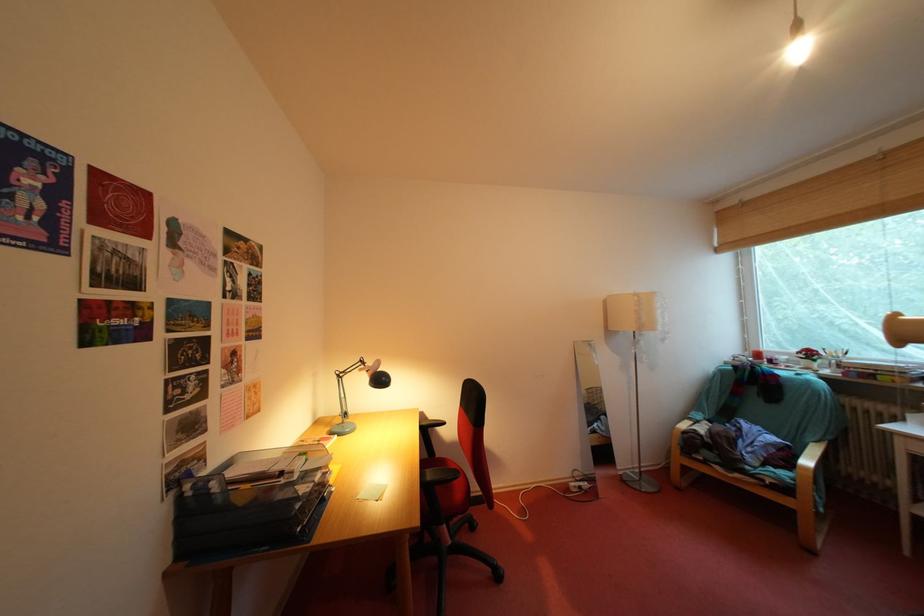
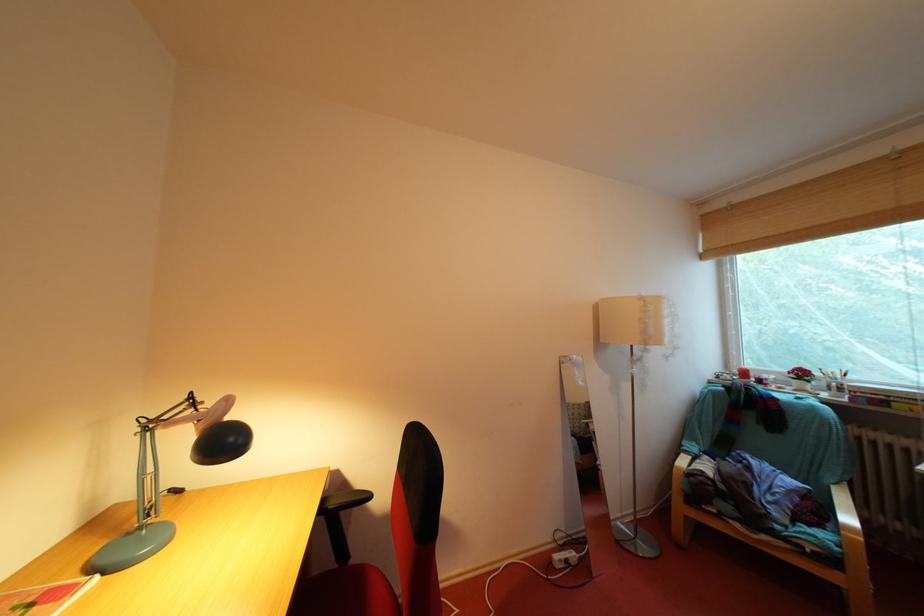
Question: The camera is either moving clockwise (left) or counter-clockwise (right) around the object. The first image is from the beginning of the video and the second image is from the end. Is the camera moving left or right when shooting the video?

Choices:
 (A) Left
 (B) Right

Answer: (A)